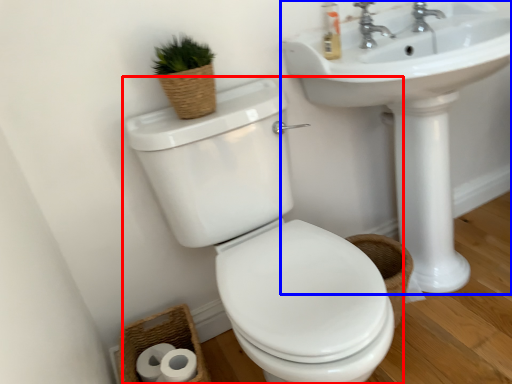
Question: Among these objects, which one is farthest to the camera, toilet (highlighted by a red box) or sink (highlighted by a blue box)?

Choices:
 (A) toilet
 (B) sink

Answer: (B)